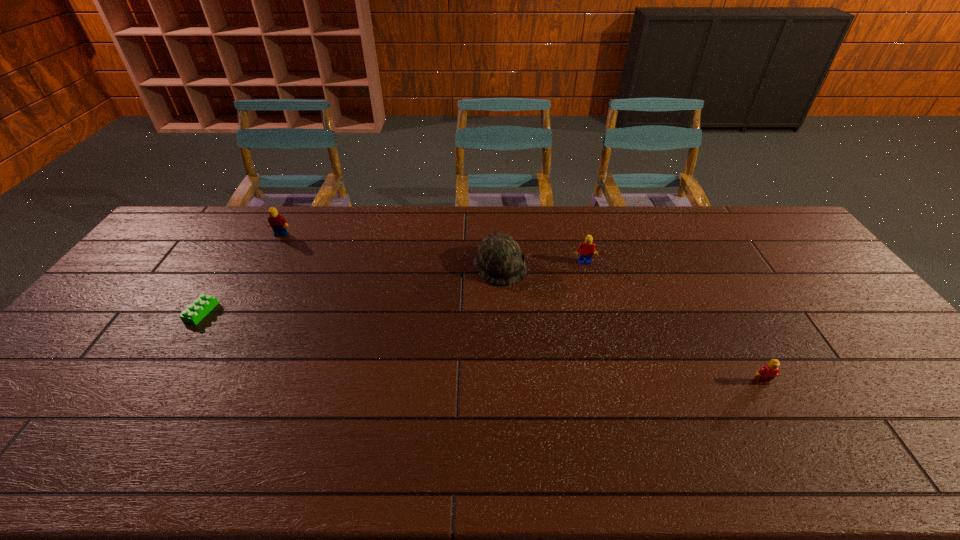
Locate an element on the screen. Image resolution: width=960 pixels, height=540 pixels. the second object from left to right is located at coordinates pyautogui.click(x=278, y=223).

Identify the location of the second Lego from left to right. The image size is (960, 540). (278, 223).

Locate an element on the screen. the third nearest Lego is located at coordinates (586, 249).

Find the location of a particular element. Image resolution: width=960 pixels, height=540 pixels. the second Lego from right to left is located at coordinates (586, 249).

Locate an element on the screen. The height and width of the screenshot is (540, 960). the third object from left to right is located at coordinates (499, 260).

You are a GUI agent. You are given a task and a screenshot of the screen. Output one action in this format:
    pyautogui.click(x=<x>, y=<y>)
    Task: Click on the rightmost object
    This screenshot has width=960, height=540.
    Given the screenshot: What is the action you would take?
    pyautogui.click(x=769, y=371)

Where is `the third tallest Lego`? the third tallest Lego is located at coordinates (769, 371).

Find the location of a particular element. The width and height of the screenshot is (960, 540). the fourth farthest object is located at coordinates (195, 312).

In order to click on the shortest object in this screenshot , I will do `click(195, 312)`.

Find the location of a particular element. This screenshot has width=960, height=540. vacant area situated 0.170m on the front-facing side of the second Lego from left to right is located at coordinates (262, 268).